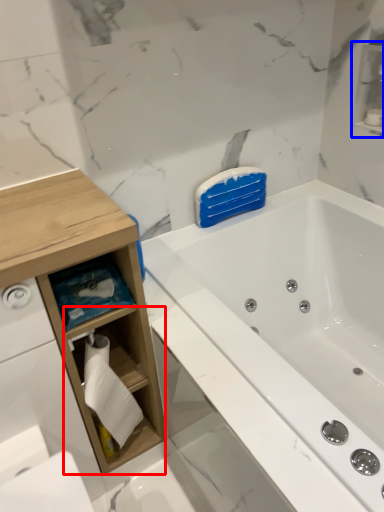
Question: Which point is closer to the camera, cabinet (highlighted by a red box) or cabinet (highlighted by a blue box)?

Choices:
 (A) cabinet
 (B) cabinet

Answer: (A)